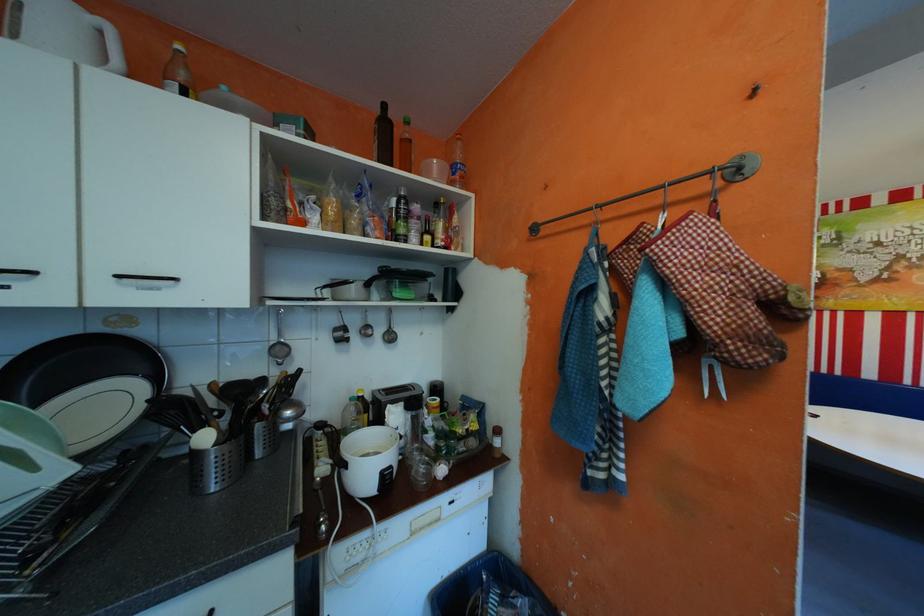
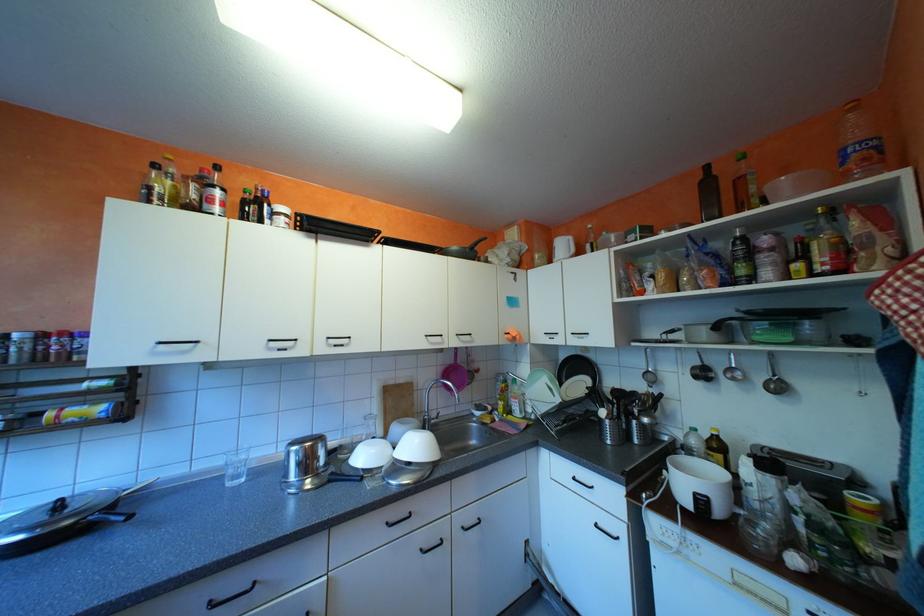
Locate, in the second image, the point that corresponds to [394,472] in the first image.

(708, 493)